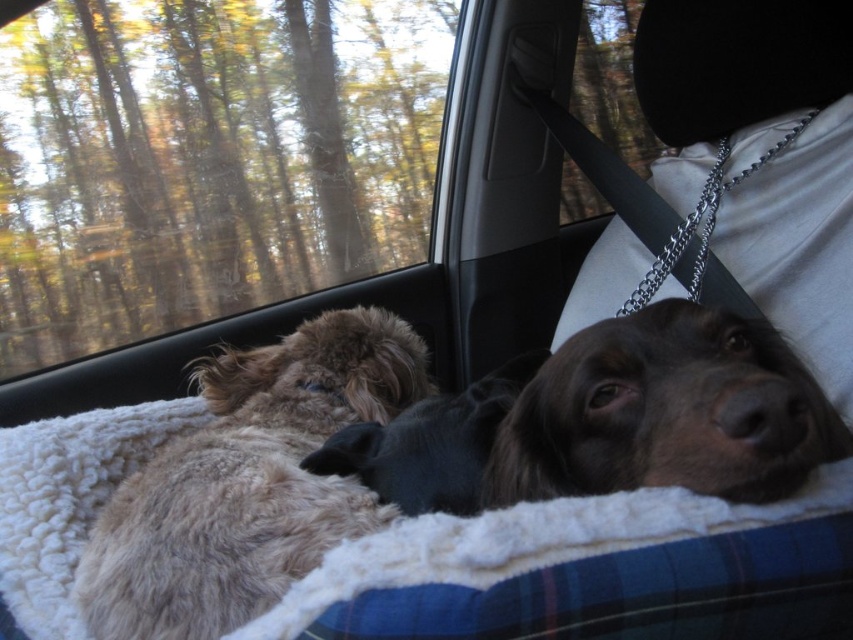
You are a dog owner who wants to ensure both dogs have enough space to stretch out comfortably on the white fleece dog bed at center. Given that the brown fuzzy dog at center is smaller than the bed, can both dogs fit on the bed at the same time?

The white fleece dog bed at center is larger in size than brown fuzzy dog at center, so there is enough space for both dogs to comfortably stretch out on the bed simultaneously.

You are a passenger in the car and want to pet both the brown fuzzy dog at center and the white fleece dog bed at center. Which one should you reach for first to avoid disturbing the other?

→ You should reach for the white fleece dog bed at center first because the brown fuzzy dog at center is behind it. By petting the bed first, you won t disturb the dog that s hidden behind it.

You are a dog owner who wants to ensure both dogs have enough space to stretch comfortably. Given that each dog requires at least 6 inches of personal space, can both fuzzy brown dog at center and brown fuzzy dog at center fit without overlapping?

The fuzzy brown dog at center is only 5.84 inches away from the brown fuzzy dog at center, which is less than the required 6 inches of personal space. Therefore, they cannot both fit without overlapping.